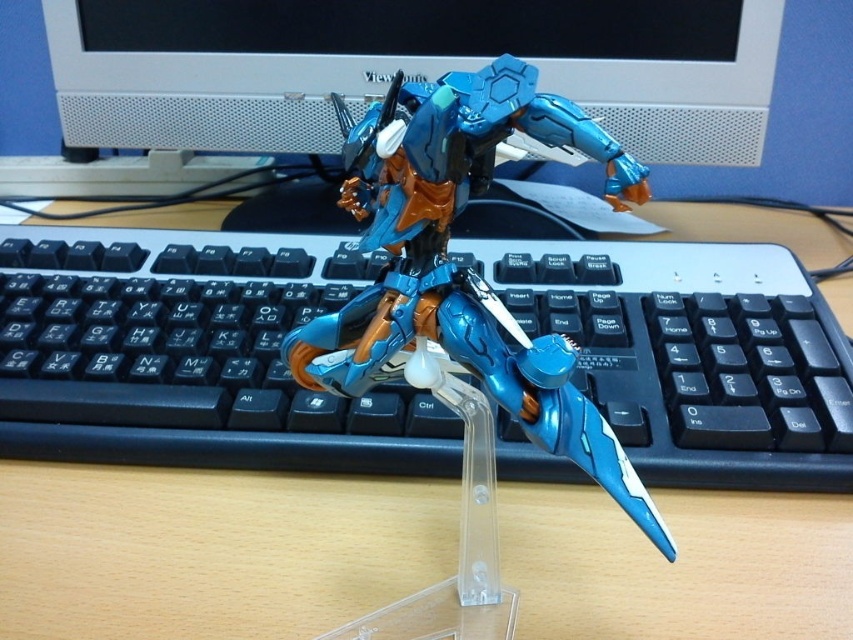
You are a photographer trying to capture the action figure and the keyboard in the scene. You want to ensure that both the point at (300, 237) and the point at (357, 80) are visible in your photo. Based on their positions, which point is closer to the camera and should be in focus first?

Point (300, 237) is in front of point (357, 80), so it is closer to the camera and should be in focus first.

You are setting up a display for a gaming setup and need to place the satin white monitor at upper center and the metallic blue robot at center. According to the image, which object is located to the left of the other?

The satin white monitor at upper center is positioned on the left side of metallic blue robot at center, so the monitor is to the left of the robot.